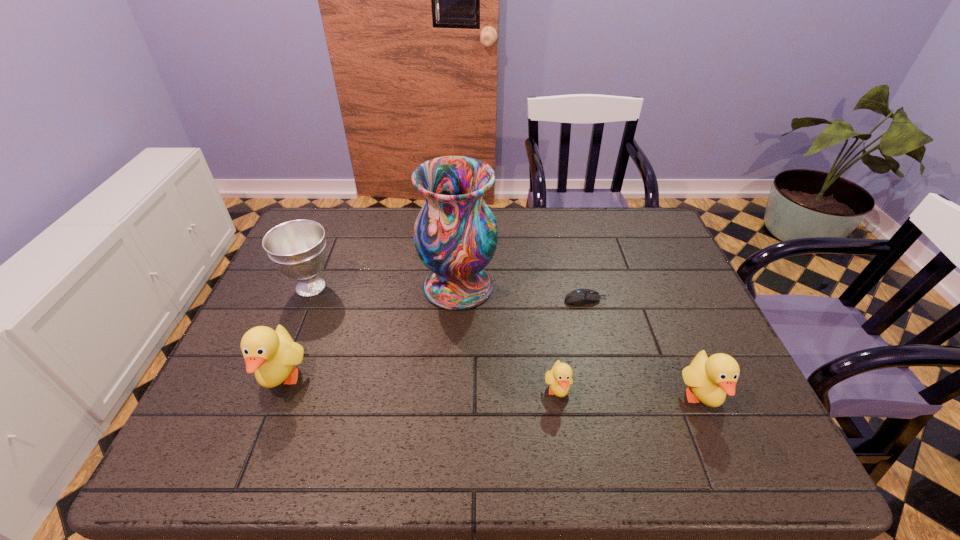
This screenshot has width=960, height=540. Find the location of `empty space between the fifth object from left to right and the tallest object`. empty space between the fifth object from left to right and the tallest object is located at coordinates (521, 293).

The image size is (960, 540). In order to click on vacant space that's between the tallest object and the shortest object in this screenshot , I will do `click(521, 293)`.

What are the coordinates of `vacant area that lies between the vase and the chalice` in the screenshot? It's located at (385, 287).

Locate an element on the screen. The image size is (960, 540). free spot between the shortest object and the leftmost duckling is located at coordinates (434, 340).

You are a GUI agent. You are given a task and a screenshot of the screen. Output one action in this format:
    pyautogui.click(x=<x>, y=<y>)
    Task: Click on the fifth closest object to the shortest duckling
    The height and width of the screenshot is (540, 960).
    Given the screenshot: What is the action you would take?
    (x=297, y=248)

Locate an element on the screen. The height and width of the screenshot is (540, 960). object that is the fifth closest to the second object from right to left is located at coordinates (272, 355).

Find the location of a particular element. the second closest duckling to the second duckling from left to right is located at coordinates (272, 355).

At what (x,y) coordinates should I click in order to perform the action: click on duckling that is the second closest to the leftmost duckling. Please return your answer as a coordinate pair (x, y). The height and width of the screenshot is (540, 960). Looking at the image, I should click on (709, 379).

Find the location of `free region that satisfies the following two spatial constraints: 1. on the front side of the chalice; 2. on the right side of the shortest object`. free region that satisfies the following two spatial constraints: 1. on the front side of the chalice; 2. on the right side of the shortest object is located at coordinates (305, 300).

Locate an element on the screen. The width and height of the screenshot is (960, 540). vacant point that satisfies the following two spatial constraints: 1. on the front side of the computer mouse; 2. on the left side of the tallest object is located at coordinates (458, 300).